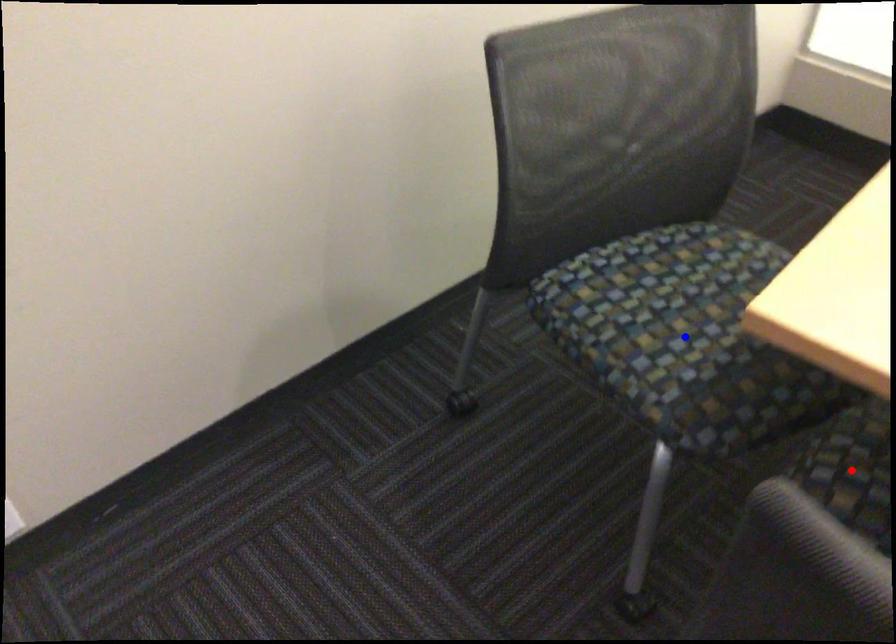
Question: Which of the two points in the image is closer to the camera?

Choices:
 (A) Blue point is closer.
 (B) Red point is closer.

Answer: (B)